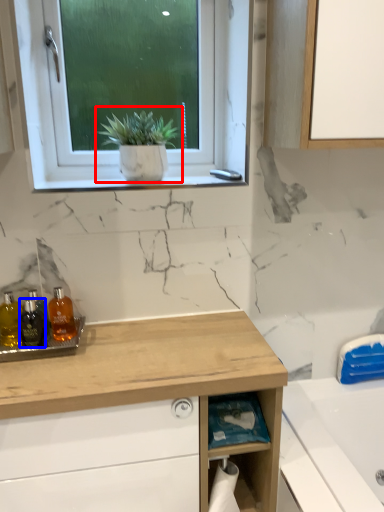
Question: Among these objects, which one is nearest to the camera, houseplant (highlighted by a red box) or bottle (highlighted by a blue box)?

Choices:
 (A) houseplant
 (B) bottle

Answer: (B)